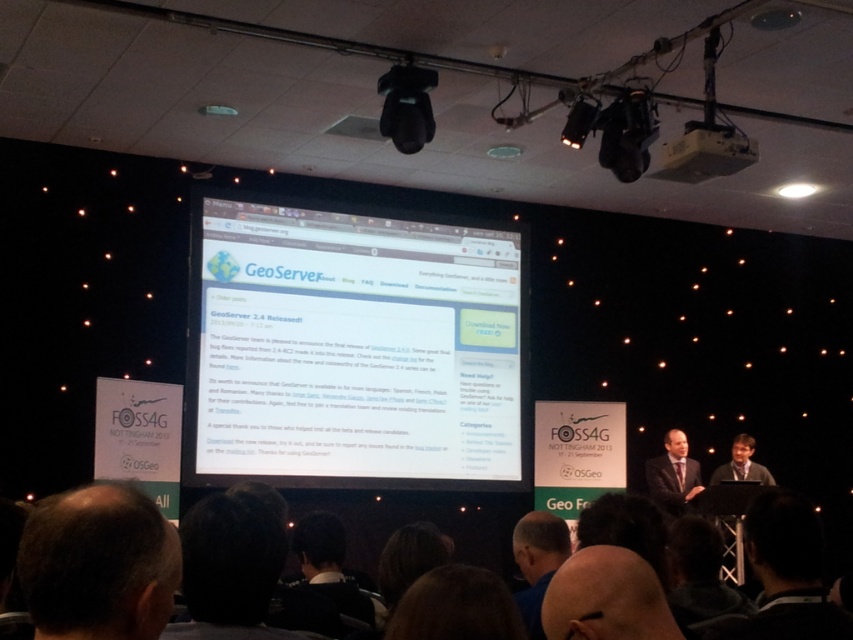
Question: Which object appears closest to the camera in this image?

Choices:
 (A) dark hair at lower left
 (B) blue shirt at lower center
 (C) matte black laptop at center

Answer: (A)

Question: Which of these objects is positioned closest to the dark gray suit at lower right?

Choices:
 (A) matte black laptop at center
 (B) dark suit at center
 (C) bald head at lower center
 (D) dark brown hair at lower left

Answer: (C)

Question: Can you confirm if white glossy projector screen at center is positioned below dark brown hair at lower left?

Choices:
 (A) no
 (B) yes

Answer: (A)

Question: Considering the real-world distances, which object is closest to the bald head at lower center?

Choices:
 (A) blue shirt at lower center
 (B) dark brown hair at lower left
 (C) dark hair at lower left
 (D) white plastic projector at upper center

Answer: (A)

Question: Is bald head at lower center to the right of white plastic projector at upper center from the viewer's perspective?

Choices:
 (A) yes
 (B) no

Answer: (B)

Question: Can you confirm if dark hair at lower left is positioned to the left of matte black laptop at center?

Choices:
 (A) yes
 (B) no

Answer: (A)